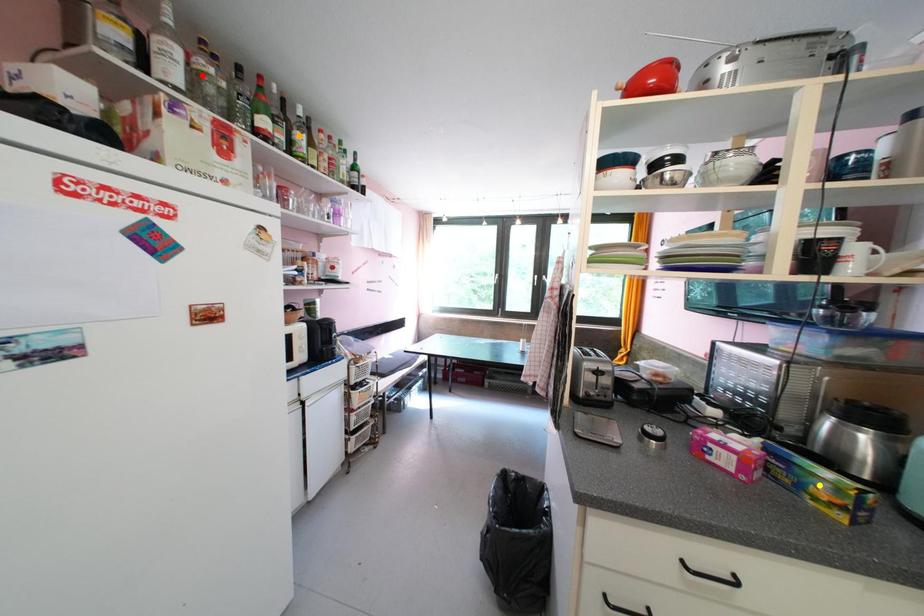
Order these from farthest to nearest:
A) orange point
B) red point
C) yellow point

orange point
red point
yellow point